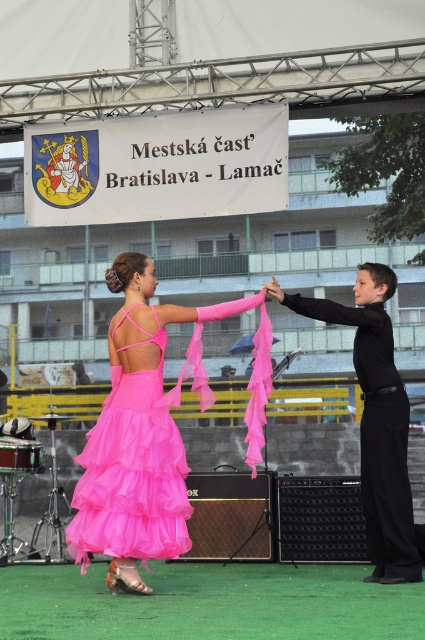
Between matte pink tulle dress at center and black smooth pants at right, which one is positioned lower?

Positioned lower is black smooth pants at right.

Between matte pink tulle dress at center and black smooth pants at right, which one has less height?

black smooth pants at right is shorter.

Does point (102, 525) lie in front of point (362, 273)?

That is True.

Locate an element on the screen. matte pink tulle dress at center is located at coordinates coord(139,435).